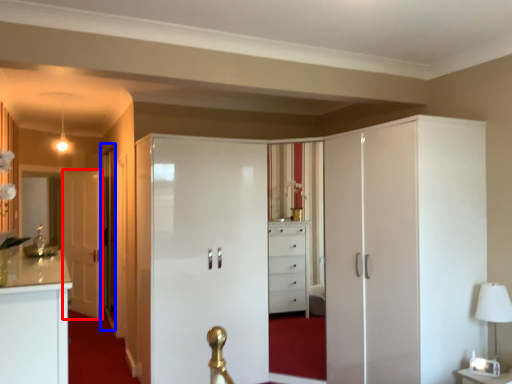
Question: Which object appears closest to the camera in this image, door (highlighted by a red box) or glass door (highlighted by a blue box)?

Choices:
 (A) door
 (B) glass door

Answer: (B)